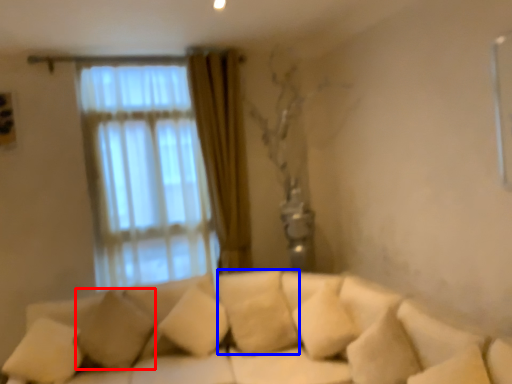
Question: Which object is further to the camera taking this photo, pillow (highlighted by a red box) or pillow (highlighted by a blue box)?

Choices:
 (A) pillow
 (B) pillow

Answer: (B)